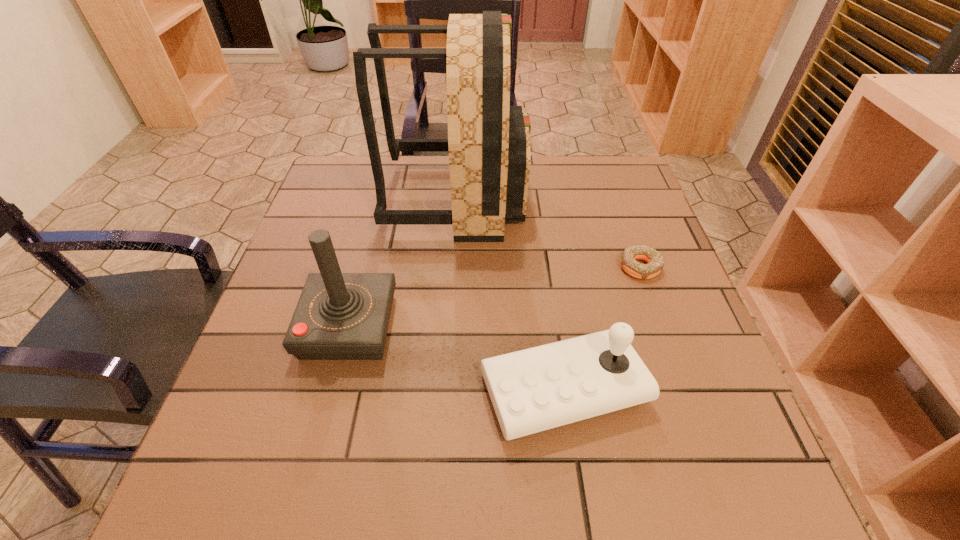
At what (x,y) coordinates should I click in order to perform the action: click on backpack. Please return your answer as a coordinate pair (x, y). Looking at the image, I should click on (488, 141).

The image size is (960, 540). In order to click on the tallest object in this screenshot , I will do [x=488, y=141].

Where is `the taller joystick`? The image size is (960, 540). the taller joystick is located at coordinates (339, 316).

This screenshot has width=960, height=540. Identify the location of the left joystick. (339, 316).

At what (x,y) coordinates should I click in order to perform the action: click on the right joystick. Please return your answer as a coordinate pair (x, y). The height and width of the screenshot is (540, 960). Looking at the image, I should click on (533, 390).

You are a GUI agent. You are given a task and a screenshot of the screen. Output one action in this format:
    pyautogui.click(x=<x>, y=<y>)
    Task: Click on the shorter joystick
    This screenshot has height=540, width=960.
    Given the screenshot: What is the action you would take?
    pyautogui.click(x=533, y=390)

At what (x,y) coordinates should I click in order to perform the action: click on the third nearest object. Please return your answer as a coordinate pair (x, y). The width and height of the screenshot is (960, 540). Looking at the image, I should click on (629, 256).

The height and width of the screenshot is (540, 960). I want to click on doughnut, so click(x=629, y=256).

This screenshot has width=960, height=540. What are the coordinates of `free region located on the front face of the backpack` in the screenshot? It's located at (623, 198).

Where is `vacant space located 0.140m on the rectangular base of the taller joystick`? The width and height of the screenshot is (960, 540). vacant space located 0.140m on the rectangular base of the taller joystick is located at coordinates click(x=462, y=326).